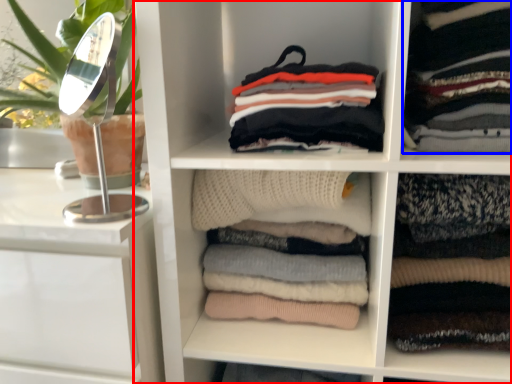
Question: Which point is closer to the camera, shelf (highlighted by a red box) or clothing (highlighted by a blue box)?

Choices:
 (A) shelf
 (B) clothing

Answer: (A)